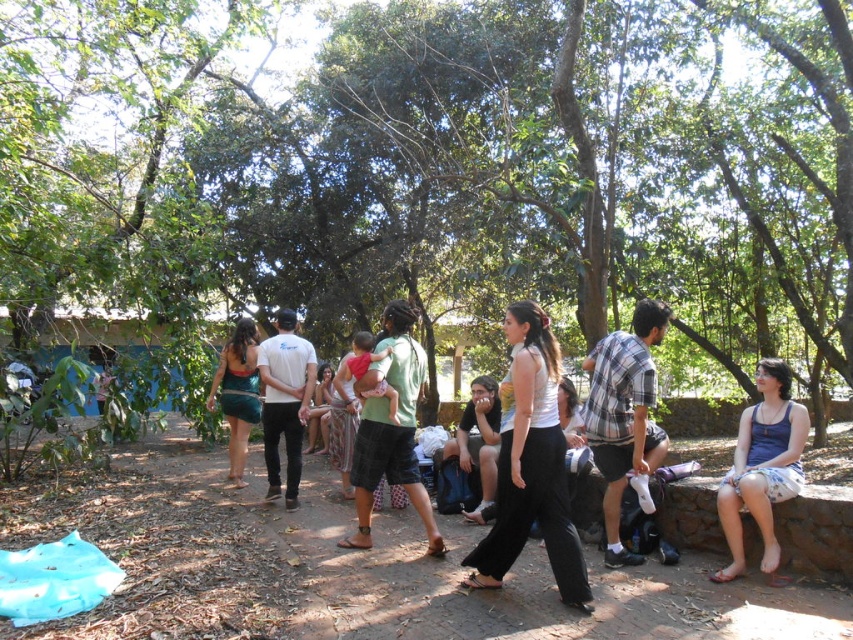
Question: Does green cotton shirt at center have a larger size compared to white cotton tank top at center?

Choices:
 (A) yes
 (B) no

Answer: (B)

Question: Does white cotton tank top at center come in front of green textured shirt at center?

Choices:
 (A) no
 (B) yes

Answer: (B)

Question: Which point is farther to the camera?

Choices:
 (A) (549, 467)
 (B) (506, 189)

Answer: (B)

Question: Is green matte shirt at center smaller than light brown fabric shirt at center?

Choices:
 (A) yes
 (B) no

Answer: (A)

Question: Which object appears farthest from the camera in this image?

Choices:
 (A) white matte shirt at center
 (B) plaid cotton shirt at center-right
 (C) light brown fabric shirt at center
 (D) green textured shirt at center

Answer: (C)

Question: Which point is closer to the camera?

Choices:
 (A) blue fabric skirt at lower right
 (B) green cotton shirt at center

Answer: (A)